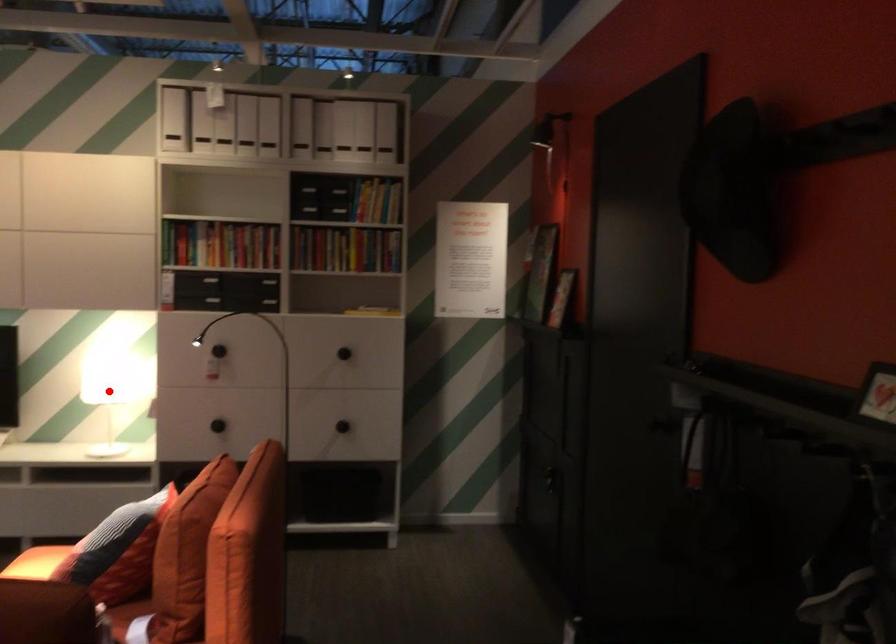
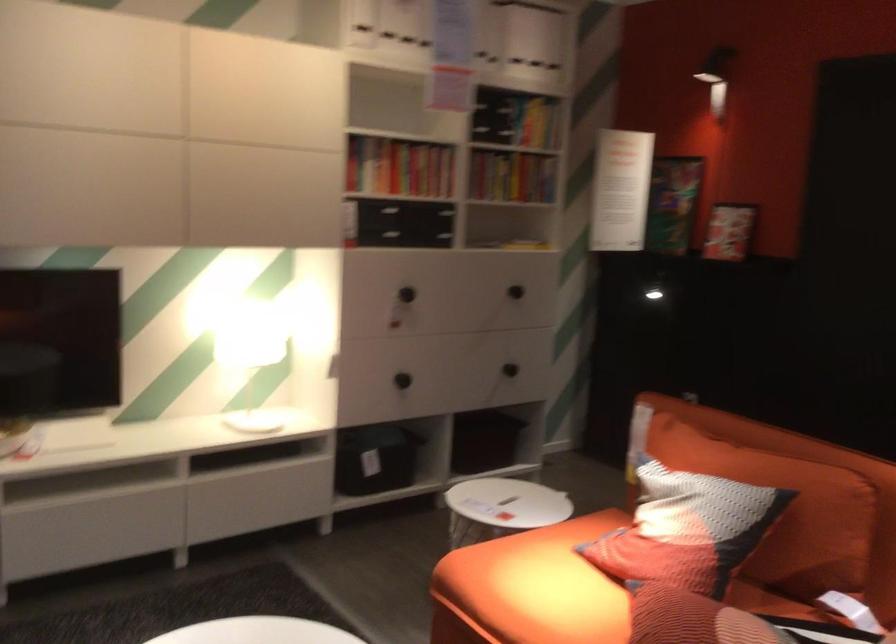
Question: I am providing you with two images of the same scene from different viewpoints. A red point is shown in image1. For the corresponding object point in image2, is it positioned nearer or farther from the camera?

Choices:
 (A) Nearer
 (B) Farther

Answer: (A)